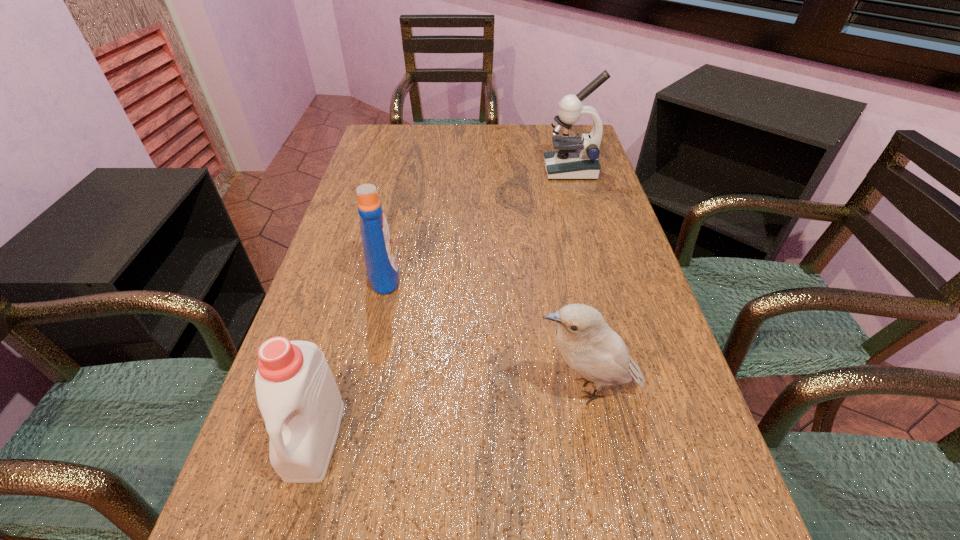
Locate an element on the screen. This screenshot has height=540, width=960. the farthest object is located at coordinates (575, 158).

Identify the location of the second farthest object. This screenshot has height=540, width=960. (382, 270).

At what (x,y) coordinates should I click in order to perform the action: click on the nearer detergent. Please return your answer as a coordinate pair (x, y). Looking at the image, I should click on (297, 395).

The width and height of the screenshot is (960, 540). I want to click on bird, so click(x=585, y=342).

Where is `free space located 0.140m at the eyepiece of the microscope`? free space located 0.140m at the eyepiece of the microscope is located at coordinates (500, 170).

What are the coordinates of `vacant space located at the eyepiece of the microscope` in the screenshot? It's located at (506, 170).

The height and width of the screenshot is (540, 960). Find the location of `blank space located 0.400m at the eyepiece of the microscope`. blank space located 0.400m at the eyepiece of the microscope is located at coordinates (416, 170).

This screenshot has width=960, height=540. Identify the location of free space located 0.100m on the label of the farther detergent. (444, 275).

Where is `free point located at the beak of the bird`? free point located at the beak of the bird is located at coordinates (484, 388).

Locate an element on the screen. The height and width of the screenshot is (540, 960). vacant space located 0.270m at the beak of the bird is located at coordinates (387, 388).